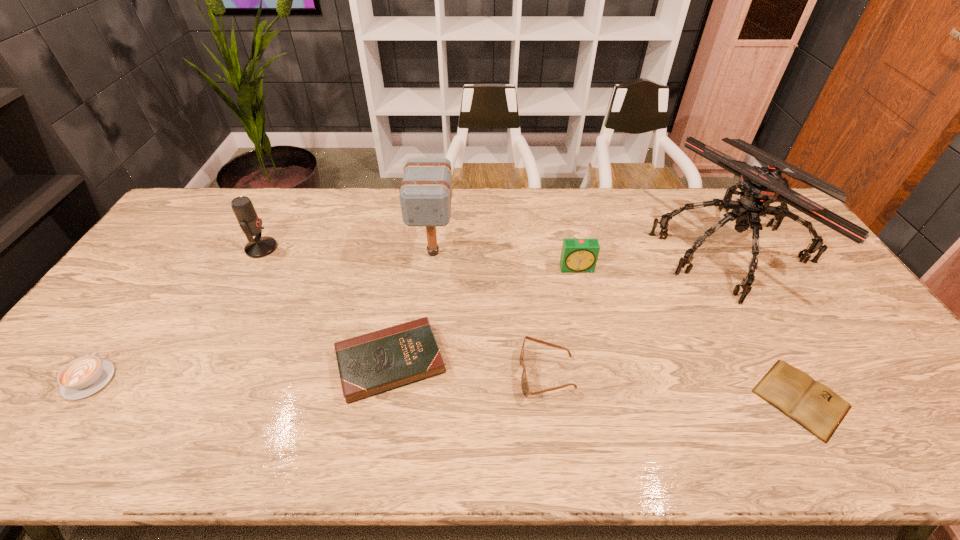
Locate an element on the screen. free space located 0.160m on the side of the leftmost object with the handle is located at coordinates (138, 312).

Where is `vacant space located 0.240m on the back of the Bible`? This screenshot has width=960, height=540. vacant space located 0.240m on the back of the Bible is located at coordinates (407, 265).

Find the location of a particular element. vacant space located on the left of the book is located at coordinates (642, 399).

What are the coordinates of `object present at the far edge` in the screenshot? It's located at (760, 186).

Find the location of a particular element. Image resolution: width=960 pixels, height=540 pixels. object located in the near edge section of the desktop is located at coordinates (x=813, y=405).

Locate an element on the screen. object located at the left edge is located at coordinates [82, 377].

This screenshot has width=960, height=540. Find the location of `object that is at the right edge`. object that is at the right edge is located at coordinates pos(760,186).

Find the location of `object that is at the far right corner`. object that is at the far right corner is located at coordinates (760, 186).

The image size is (960, 540). In order to click on vacant space at the far edge of the desktop in this screenshot , I will do `click(575, 200)`.

Find the location of a particular element. The width and height of the screenshot is (960, 540). free space at the near edge of the desktop is located at coordinates (286, 429).